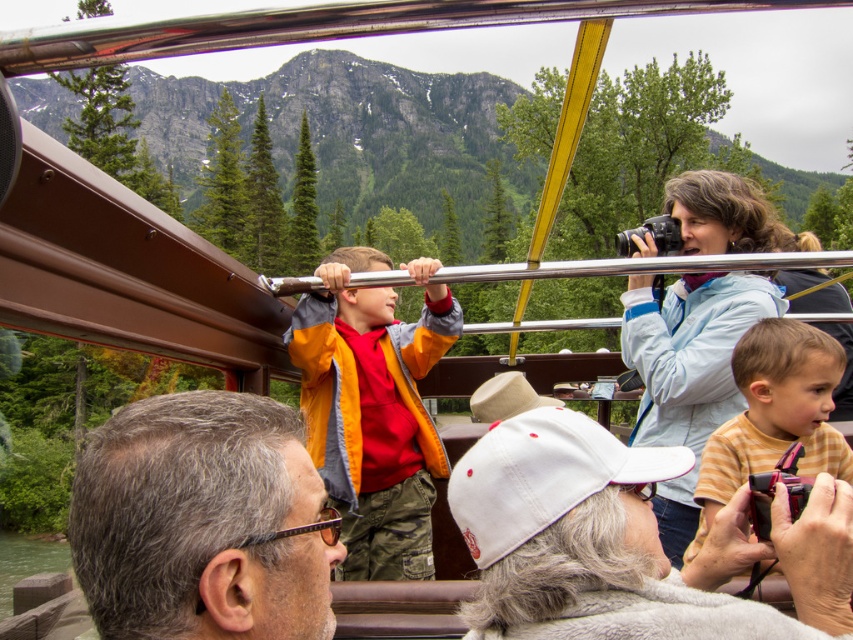
Question: Which of the following is the farthest from the observer?

Choices:
 (A) (431, 324)
 (B) (668, 548)

Answer: (A)

Question: Is orange/yellow jacket at center bigger than yellow striped shirt at center?

Choices:
 (A) no
 (B) yes

Answer: (B)

Question: Which point appears closest to the camera in this image?

Choices:
 (A) (345, 458)
 (B) (660, 365)

Answer: (B)

Question: Which point is farther to the camera?

Choices:
 (A) (413, 413)
 (B) (647, 236)
 (C) (743, 378)
 (D) (97, 612)

Answer: (A)

Question: Is orange/yellow jacket at center to the left of light blue jacket at upper right from the viewer's perspective?

Choices:
 (A) no
 (B) yes

Answer: (B)

Question: Observing the image, what is the correct spatial positioning of white cotton cap at center in reference to light blue jacket at upper right?

Choices:
 (A) right
 (B) left

Answer: (B)